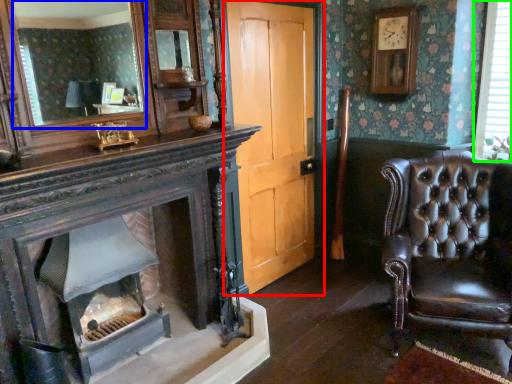
Question: Which object is the farthest from door (highlighted by a red box)? Choose among these: mirror (highlighted by a blue box) or window (highlighted by a green box).

Choices:
 (A) mirror
 (B) window

Answer: (A)